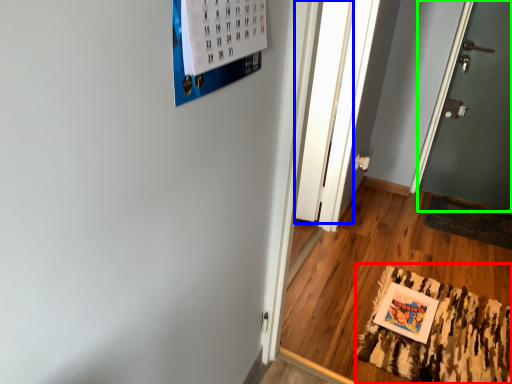
Question: Which object is the closest to the mat (highlighted by a red box)? Choose among these: glass door (highlighted by a blue box) or door (highlighted by a green box).

Choices:
 (A) glass door
 (B) door

Answer: (A)